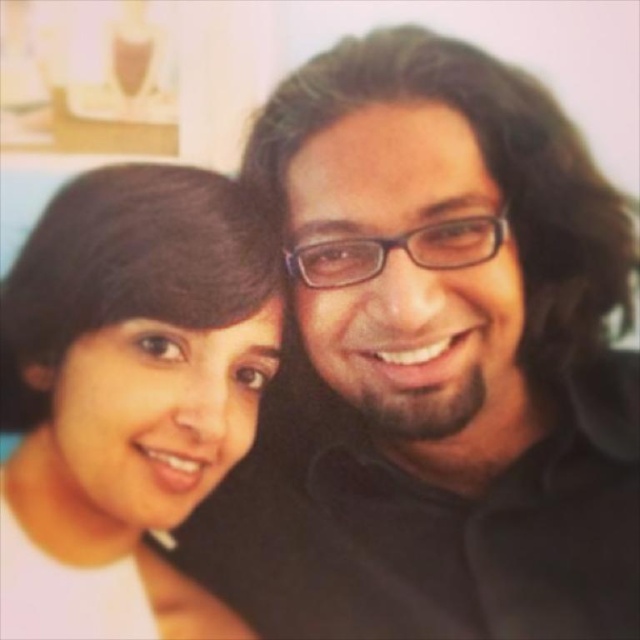
From the picture: Is black matte shirt at center above matte white shirt at left?

Yes.

Consider the image. Between black matte shirt at center and matte white shirt at left, which one appears on the left side from the viewer's perspective?

Positioned to the left is matte white shirt at left.

I want to click on black matte shirt at center, so click(435, 364).